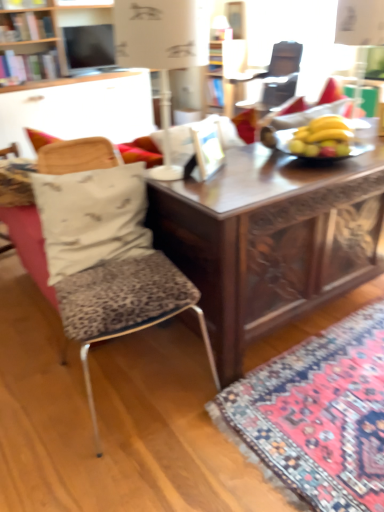
At what (x,y) coordinates should I click in order to perform the action: click on vacant space underneath white paper lampshade at upper center (from a real-world perspective). Please return your answer as a coordinate pair (x, y). The height and width of the screenshot is (512, 384). Looking at the image, I should click on (171, 170).